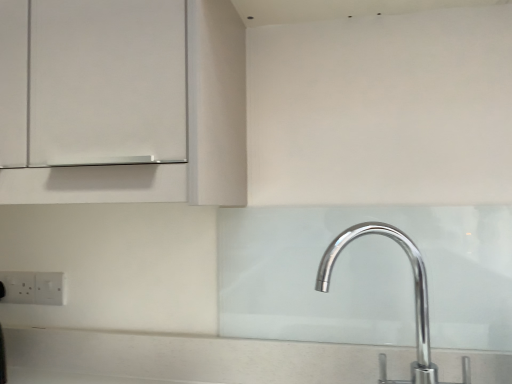
Question: Would you consider polished chrome tap at lower right to be distant from white plastic electric outlet at lower left, marked as the 2th electric outlet in a right-to-left arrangement?

Choices:
 (A) no
 (B) yes

Answer: (A)

Question: Is polished chrome tap at lower right smaller than white plastic electric outlet at lower left, marked as the first electric outlet in a left-to-right arrangement?

Choices:
 (A) no
 (B) yes

Answer: (A)

Question: Is polished chrome tap at lower right facing towards white plastic electric outlet at lower left, marked as the 2th electric outlet in a right-to-left arrangement?

Choices:
 (A) yes
 (B) no

Answer: (B)

Question: From a real-world perspective, does polished chrome tap at lower right sit lower than white plastic electric outlet at lower left, marked as the 2th electric outlet in a right-to-left arrangement?

Choices:
 (A) yes
 (B) no

Answer: (B)

Question: Is polished chrome tap at lower right with white plastic electric outlet at lower left, marked as the 2th electric outlet in a right-to-left arrangement?

Choices:
 (A) no
 (B) yes

Answer: (A)

Question: Considering the relative sizes of polished chrome tap at lower right and white plastic electric outlet at lower left, marked as the 2th electric outlet in a right-to-left arrangement, in the image provided, is polished chrome tap at lower right shorter than white plastic electric outlet at lower left, marked as the 2th electric outlet in a right-to-left arrangement,?

Choices:
 (A) yes
 (B) no

Answer: (B)

Question: Is polished chrome tap at lower right located within white plastic electric outlet at lower left, which ranks as the first electric outlet in right-to-left order?

Choices:
 (A) no
 (B) yes

Answer: (A)

Question: Are white plastic electric outlet at lower left, which ranks as the first electric outlet in right-to-left order, and polished chrome tap at lower right beside each other?

Choices:
 (A) yes
 (B) no

Answer: (B)

Question: From a real-world perspective, is white plastic electric outlet at lower left, acting as the second electric outlet starting from the left, under polished chrome tap at lower right?

Choices:
 (A) no
 (B) yes

Answer: (B)

Question: Would you consider white plastic electric outlet at lower left, which ranks as the first electric outlet in right-to-left order, to be distant from polished chrome tap at lower right?

Choices:
 (A) yes
 (B) no

Answer: (B)

Question: Does white plastic electric outlet at lower left, which ranks as the first electric outlet in right-to-left order, have a smaller size compared to polished chrome tap at lower right?

Choices:
 (A) yes
 (B) no

Answer: (A)

Question: Is white plastic electric outlet at lower left, which ranks as the first electric outlet in right-to-left order, thinner than polished chrome tap at lower right?

Choices:
 (A) yes
 (B) no

Answer: (A)

Question: Is white plastic electric outlet at lower left, acting as the second electric outlet starting from the left, inside white plastic electric outlet at lower left, marked as the 2th electric outlet in a right-to-left arrangement?

Choices:
 (A) no
 (B) yes

Answer: (A)